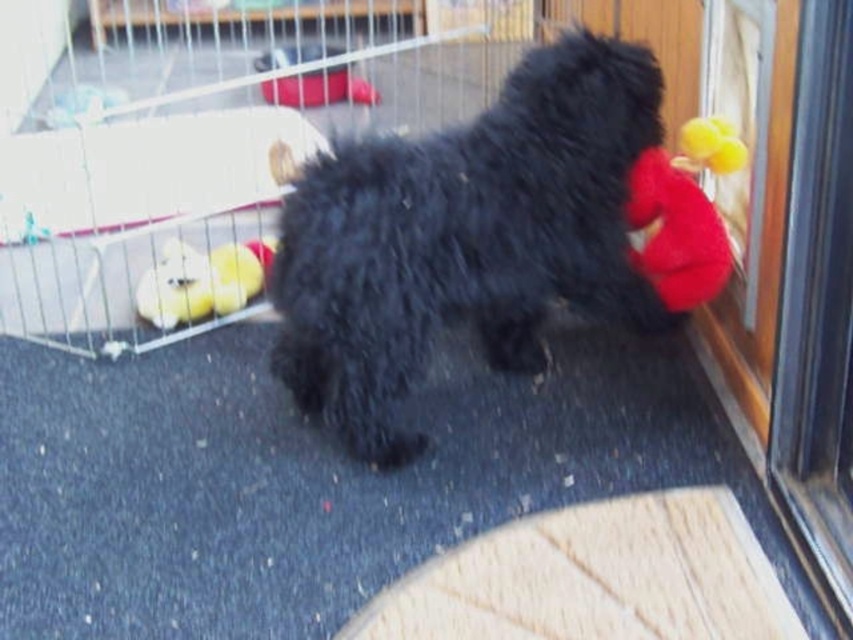
You are a pet owner who wants to retrieve the red plush toy at right from the metal wire cage at center. Can you reach it without opening the cage?

The red plush toy at right is behind the metal wire cage at center, so you cannot reach it without opening the cage because it is positioned behind the cage structure.

You are a pet owner who wants to place a new toy for your dog. The dog is currently holding the red plush toy at right. If you want to place another toy near the yellow plush duck at left without disturbing the dog, where should you place it?

The red plush toy at right is positioned over the yellow plush duck at left, so placing the new toy near the yellow plush duck at left would require placing it underneath or beside the red plush toy at right to avoid disturbing the dog.